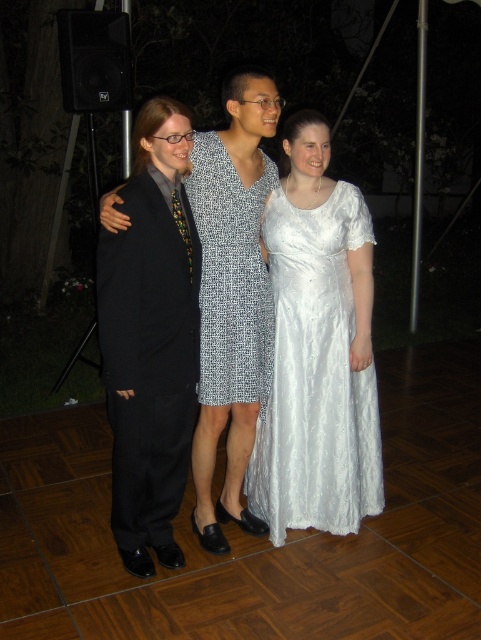
Question: Based on their relative distances, which object is nearer to the black matte suit at left?

Choices:
 (A) white satin dress at center
 (B) printed fabric dress at center

Answer: (B)

Question: Considering the real-world distances, which object is closest to the white satin dress at center?

Choices:
 (A) black matte suit at left
 (B) printed fabric dress at center

Answer: (B)

Question: Does black matte suit at left appear on the left side of printed fabric dress at center?

Choices:
 (A) yes
 (B) no

Answer: (A)

Question: Can you confirm if black matte suit at left is thinner than white satin dress at center?

Choices:
 (A) yes
 (B) no

Answer: (A)

Question: Is white satin dress at center wider than printed fabric dress at center?

Choices:
 (A) no
 (B) yes

Answer: (B)

Question: Which object is the farthest from the printed fabric dress at center?

Choices:
 (A) black matte suit at left
 (B) white satin dress at center

Answer: (A)